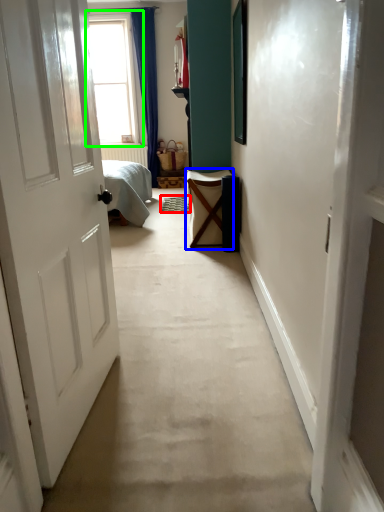
Question: Which is nearer to the doormat (highlighted by a red box)? furniture (highlighted by a blue box) or window (highlighted by a green box).

Choices:
 (A) furniture
 (B) window

Answer: (A)